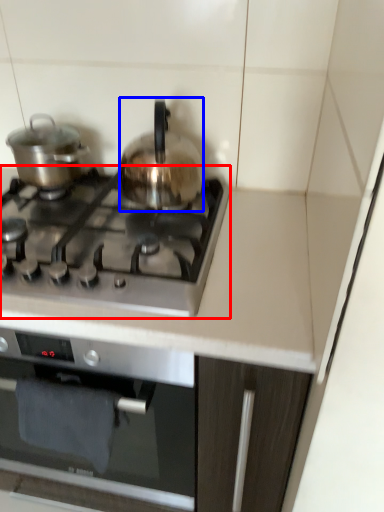
Question: Which of the following is the closest to the observer, gas stove (highlighted by a red box) or kitchen appliance (highlighted by a blue box)?

Choices:
 (A) gas stove
 (B) kitchen appliance

Answer: (A)